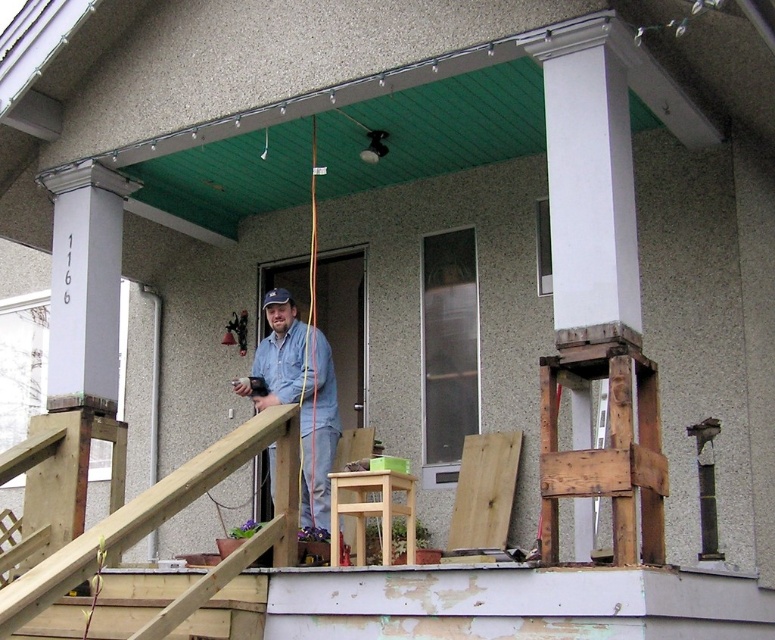
Which of these two, light brown wood chair at center or light brown wooden stool at center, stands shorter?

light brown wooden stool at center

Between light brown wood chair at center and light brown wooden stool at center, which one appears on the left side from the viewer's perspective?

From the viewer's perspective, light brown wooden stool at center appears more on the left side.

Who is more distant from viewer, (493, 522) or (388, 545)?

Positioned behind is point (493, 522).

Find the location of a particular element. This screenshot has height=640, width=775. light brown wood chair at center is located at coordinates (484, 490).

Does blue denim shirt at center have a lesser width compared to light brown wood chair at center?

No, blue denim shirt at center is not thinner than light brown wood chair at center.

Can you confirm if blue denim shirt at center is shorter than light brown wood chair at center?

No, blue denim shirt at center is not shorter than light brown wood chair at center.

Locate an element on the screen. Image resolution: width=775 pixels, height=640 pixels. blue denim shirt at center is located at coordinates (298, 396).

Is blue denim shirt at center smaller than light brown wooden stool at center?

No, blue denim shirt at center is not smaller than light brown wooden stool at center.

At what (x,y) coordinates should I click in order to perform the action: click on blue denim shirt at center. Please return your answer as a coordinate pair (x, y). This screenshot has width=775, height=640. Looking at the image, I should click on (298, 396).

Find the location of a particular element. The image size is (775, 640). blue denim shirt at center is located at coordinates (298, 396).